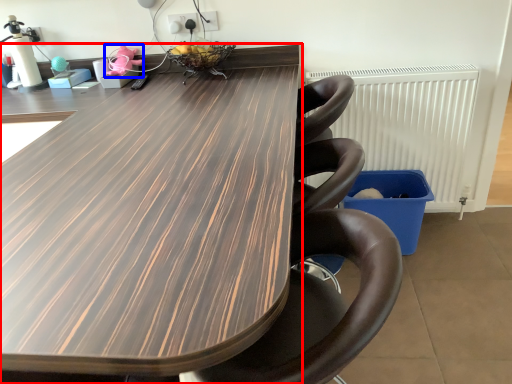
Question: Among these objects, which one is farthest to the camera, table (highlighted by a red box) or toy (highlighted by a blue box)?

Choices:
 (A) table
 (B) toy

Answer: (B)